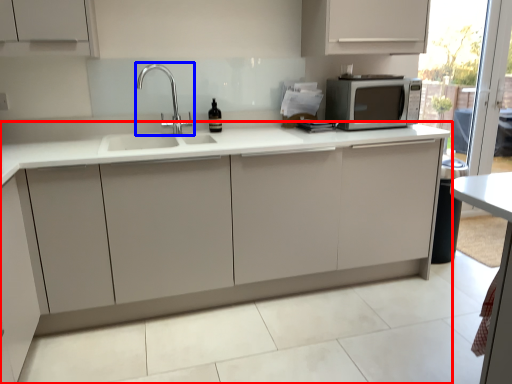
Question: Which point is closer to the camera, cabinetry (highlighted by a red box) or tap (highlighted by a blue box)?

Choices:
 (A) cabinetry
 (B) tap

Answer: (A)